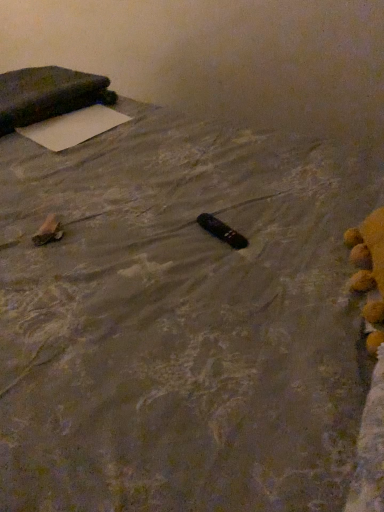
Question: From the image's perspective, does brown paper bag at lower left, the 1th waste in the left-to-right sequence, appear higher than dark fabric pillow at upper left?

Choices:
 (A) yes
 (B) no

Answer: (B)

Question: Is brown paper bag at lower left, the 1th waste in the left-to-right sequence, outside dark fabric pillow at upper left?

Choices:
 (A) yes
 (B) no

Answer: (A)

Question: Is brown paper bag at lower left, the second waste when ordered from right to left, closer to camera compared to dark fabric pillow at upper left?

Choices:
 (A) yes
 (B) no

Answer: (A)

Question: From a real-world perspective, is brown paper bag at lower left, the second waste when ordered from right to left, located beneath dark fabric pillow at upper left?

Choices:
 (A) no
 (B) yes

Answer: (B)

Question: From a real-world perspective, is brown paper bag at lower left, the 1th waste in the left-to-right sequence, located higher than dark fabric pillow at upper left?

Choices:
 (A) yes
 (B) no

Answer: (B)

Question: From the image's perspective, is brown paper bag at lower left, the 1th waste in the left-to-right sequence, located beneath dark fabric pillow at upper left?

Choices:
 (A) no
 (B) yes

Answer: (B)

Question: Does white matte yoga mat at upper left appear on the right side of brown paper bag at lower left, the 1th waste in the left-to-right sequence?

Choices:
 (A) no
 (B) yes

Answer: (A)

Question: Could you tell me if white matte yoga mat at upper left is facing brown paper bag at lower left, the 1th waste in the left-to-right sequence?

Choices:
 (A) no
 (B) yes

Answer: (A)

Question: Considering the relative sizes of white matte yoga mat at upper left and brown paper bag at lower left, the 1th waste in the left-to-right sequence, in the image provided, is white matte yoga mat at upper left thinner than brown paper bag at lower left, the 1th waste in the left-to-right sequence,?

Choices:
 (A) yes
 (B) no

Answer: (B)

Question: Is the depth of white matte yoga mat at upper left less than that of brown paper bag at lower left, the 1th waste in the left-to-right sequence?

Choices:
 (A) yes
 (B) no

Answer: (B)

Question: Is white matte yoga mat at upper left bigger than brown paper bag at lower left, the second waste when ordered from right to left?

Choices:
 (A) no
 (B) yes

Answer: (B)

Question: Is white matte yoga mat at upper left completely or partially outside of brown paper bag at lower left, the second waste when ordered from right to left?

Choices:
 (A) yes
 (B) no

Answer: (A)

Question: Can you confirm if dark fabric pillow at upper left is positioned to the right of brown paper bag at lower left, the second waste when ordered from right to left?

Choices:
 (A) yes
 (B) no

Answer: (B)